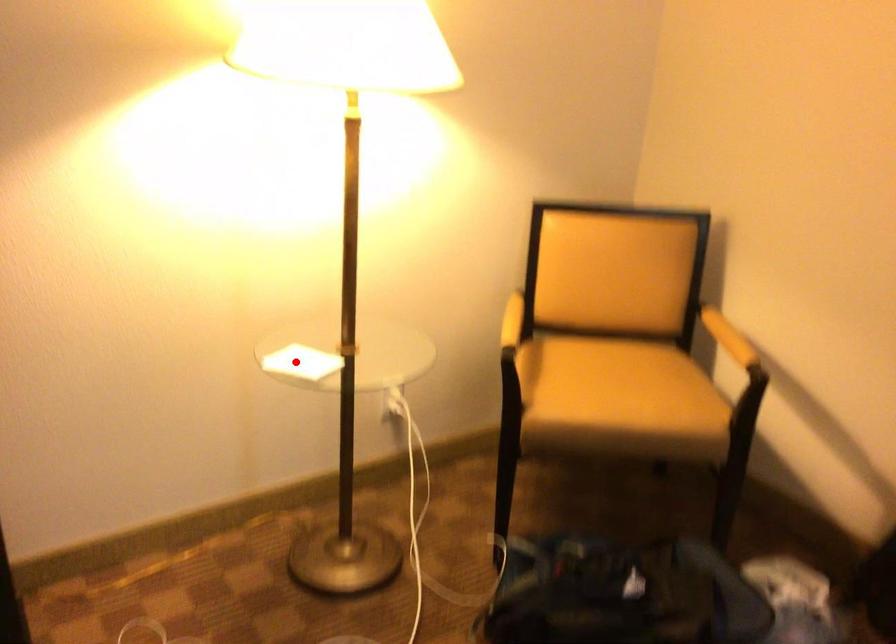
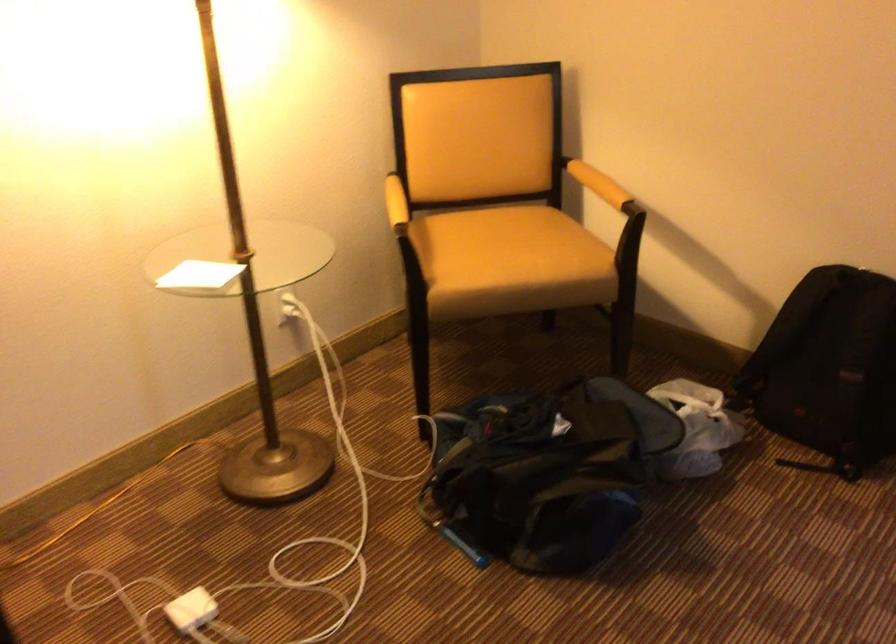
In the second image, find the point that corresponds to the highlighted location in the first image.

(199, 275)